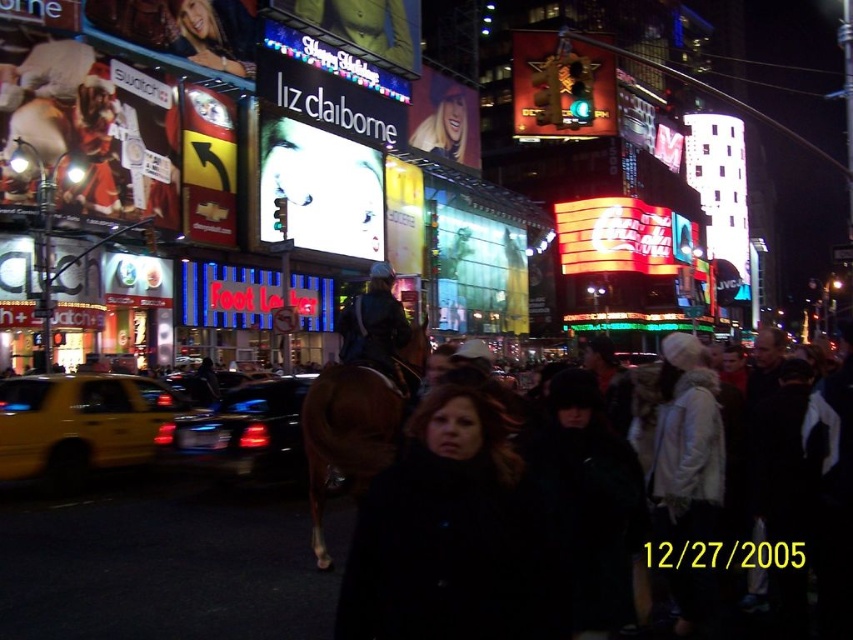
Can you confirm if dark wool coat at center is positioned to the right of metallic chevrolet sign at upper left?

Indeed, dark wool coat at center is positioned on the right side of metallic chevrolet sign at upper left.

Can you confirm if dark wool coat at center is positioned to the left of metallic chevrolet sign at upper left?

No, dark wool coat at center is not to the left of metallic chevrolet sign at upper left.

Is point (358, 524) positioned before point (196, 237)?

Yes, it is in front of point (196, 237).

You are a GUI agent. You are given a task and a screenshot of the screen. Output one action in this format:
    pyautogui.click(x=<x>, y=<y>)
    Task: Click on the dark wool coat at center
    This screenshot has width=853, height=640.
    Given the screenshot: What is the action you would take?
    [x=447, y=534]

Which is above, yellow matte taxi at left or metallic gold sign at center?

metallic gold sign at center is higher up.

Is yellow matte taxi at left below metallic gold sign at center?

Yes.

The width and height of the screenshot is (853, 640). I want to click on yellow matte taxi at left, so click(x=79, y=422).

Who is positioned more to the right, shiny black car at center or dark brown leather jacket at center?

dark brown leather jacket at center is more to the right.

Where is `shiny black car at center`? The image size is (853, 640). shiny black car at center is located at coordinates (241, 435).

Which is in front, point (234, 401) or point (361, 358)?

Point (361, 358)

Identify the location of shiny black car at center. The image size is (853, 640). (241, 435).